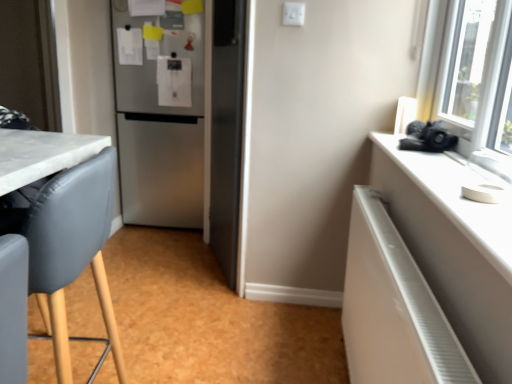
Question: Is white glossy radiator at right further to camera compared to matte gray chair at left?

Choices:
 (A) yes
 (B) no

Answer: (B)

Question: Is white glossy radiator at right far away from matte gray chair at left?

Choices:
 (A) no
 (B) yes

Answer: (A)

Question: Could you tell me if white glossy radiator at right is facing matte gray chair at left?

Choices:
 (A) no
 (B) yes

Answer: (B)

Question: Considering the relative sizes of white glossy radiator at right and matte gray chair at left in the image provided, is white glossy radiator at right smaller than matte gray chair at left?

Choices:
 (A) yes
 (B) no

Answer: (A)

Question: Does white glossy radiator at right have a lesser width compared to matte gray chair at left?

Choices:
 (A) yes
 (B) no

Answer: (A)

Question: Visually, is satin silver refrigerator at center positioned to the left or to the right of matte gray chair at left?

Choices:
 (A) left
 (B) right

Answer: (B)

Question: From a real-world perspective, is satin silver refrigerator at center above or below matte gray chair at left?

Choices:
 (A) above
 (B) below

Answer: (A)

Question: From the image's perspective, is satin silver refrigerator at center located above or below matte gray chair at left?

Choices:
 (A) above
 (B) below

Answer: (A)

Question: Looking at their shapes, would you say satin silver refrigerator at center is wider or thinner than matte gray chair at left?

Choices:
 (A) wide
 (B) thin

Answer: (A)

Question: Is matte gray chair at left bigger or smaller than satin silver refrigerator at center?

Choices:
 (A) small
 (B) big

Answer: (A)

Question: Is matte gray chair at left to the left or to the right of satin silver refrigerator at center in the image?

Choices:
 (A) right
 (B) left

Answer: (B)

Question: Is point (80, 182) closer or farther from the camera than point (119, 24)?

Choices:
 (A) farther
 (B) closer

Answer: (B)

Question: Considering the positions of matte gray chair at left and satin silver refrigerator at center in the image, is matte gray chair at left taller or shorter than satin silver refrigerator at center?

Choices:
 (A) tall
 (B) short

Answer: (B)

Question: From the image's perspective, is satin silver refrigerator at center positioned above or below white glossy radiator at right?

Choices:
 (A) below
 (B) above

Answer: (B)

Question: In terms of size, does satin silver refrigerator at center appear bigger or smaller than white glossy radiator at right?

Choices:
 (A) small
 (B) big

Answer: (B)